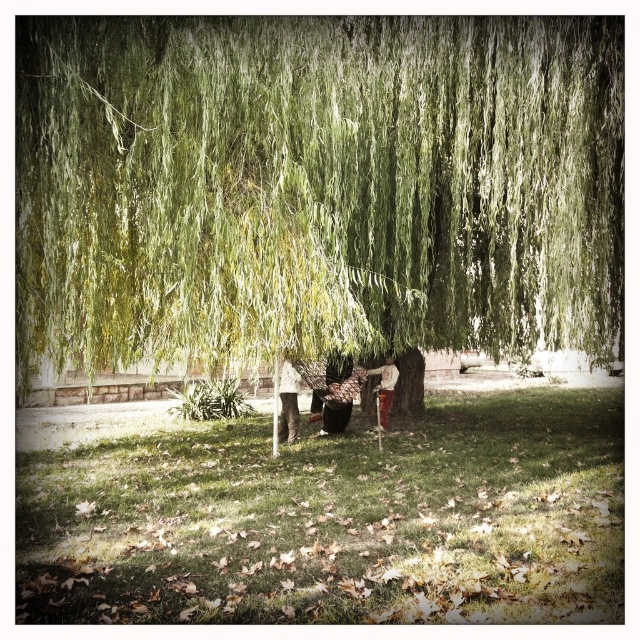
Question: Is green leafy willow at center wider than green grass at lower center?

Choices:
 (A) no
 (B) yes

Answer: (A)

Question: Which point is farther from the camera taking this photo?

Choices:
 (A) (500, 436)
 (B) (493, 216)

Answer: (A)

Question: Does green leafy willow at center lie behind green grass at lower center?

Choices:
 (A) yes
 (B) no

Answer: (A)

Question: Among these objects, which one is nearest to the camera?

Choices:
 (A) green grass at lower center
 (B) green leafy willow at center

Answer: (A)

Question: In this image, where is green leafy willow at center located relative to green grass at lower center?

Choices:
 (A) above
 (B) below

Answer: (A)